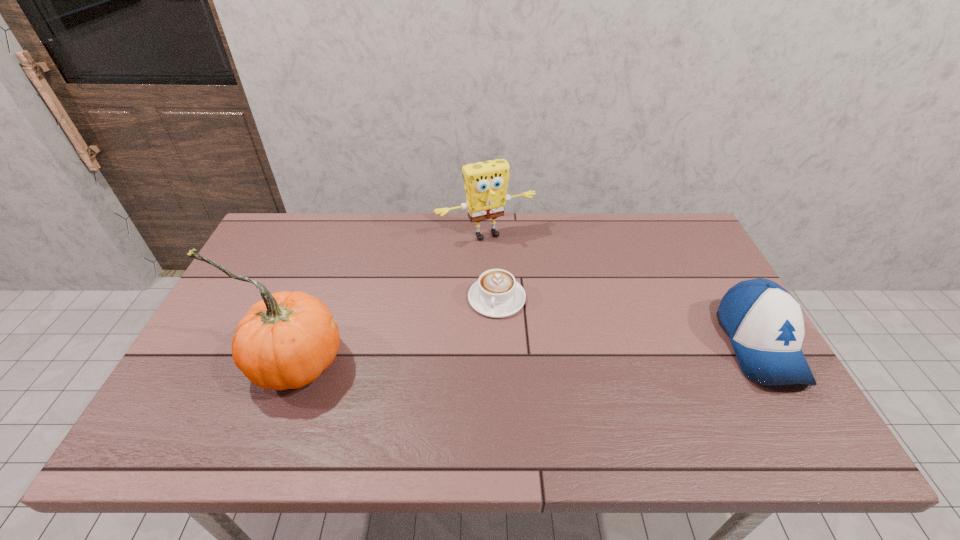
At what (x,y) coordinates should I click in order to perform the action: click on the tallest object. Please return your answer as a coordinate pair (x, y). Looking at the image, I should click on (285, 341).

This screenshot has height=540, width=960. I want to click on pumpkin, so click(x=285, y=341).

Where is `the second shortest object`? This screenshot has height=540, width=960. the second shortest object is located at coordinates (764, 322).

Locate an element on the screen. the rightmost object is located at coordinates (764, 322).

Identify the location of the third shortest object. (485, 183).

You are a GUI agent. You are given a task and a screenshot of the screen. Output one action in this format:
    pyautogui.click(x=<x>, y=<y>)
    Task: Click on the farthest object
    The image size is (960, 540).
    Given the screenshot: What is the action you would take?
    pyautogui.click(x=485, y=183)

Where is `the shortest object`? the shortest object is located at coordinates coord(496,294).

I want to click on free space located on the right of the leftmost object, so click(425, 361).

You are a GUI agent. You are given a task and a screenshot of the screen. Output one action in this format:
    pyautogui.click(x=<x>, y=<y>)
    Task: Click on the free space located 0.190m on the face of the farthest object
    This screenshot has width=960, height=540.
    Given the screenshot: What is the action you would take?
    pyautogui.click(x=526, y=283)

Find the location of `vacant space situated on the face of the farthest object`. vacant space situated on the face of the farthest object is located at coordinates (551, 323).